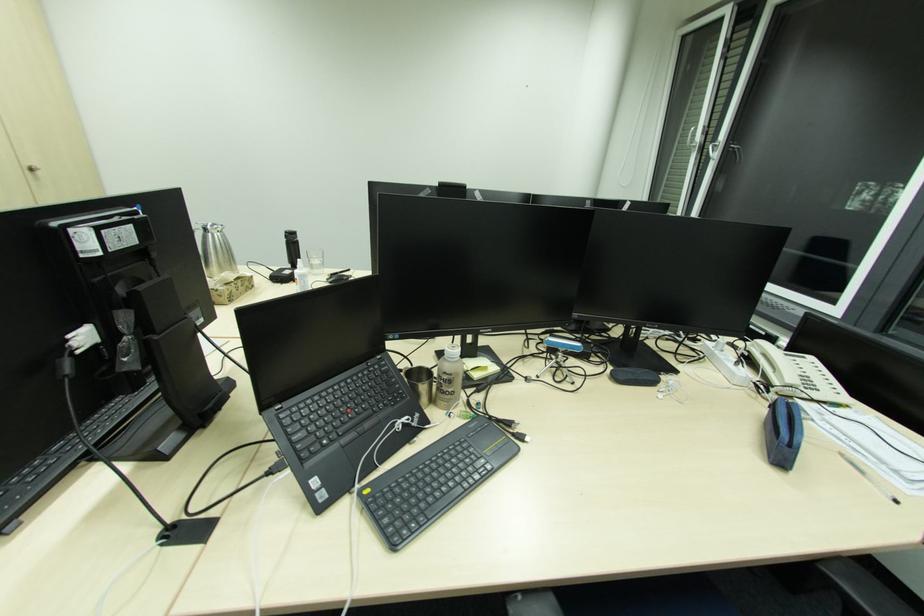
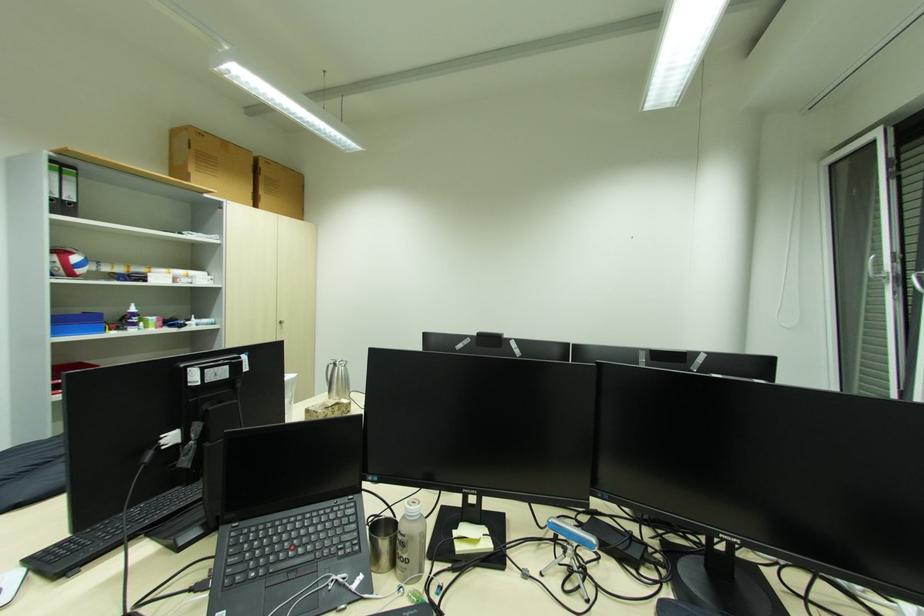
The images are taken continuously from a first-person perspective. In which direction is your viewpoint rotating?

The camera rotated toward left-up.